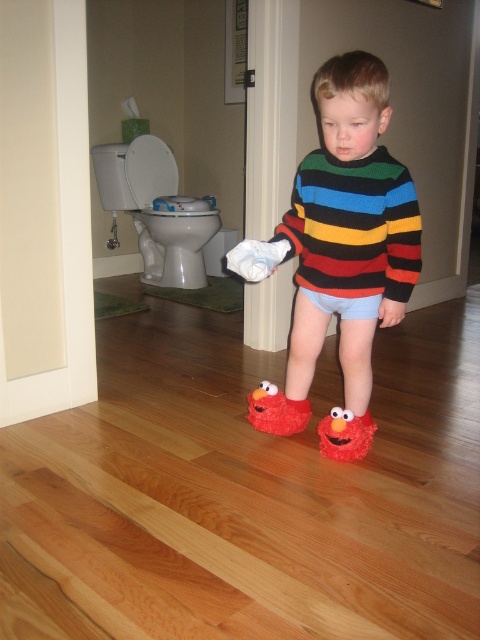
Can you confirm if fluffy red elmo slipper at lower center is positioned to the left of white soft socks at center?

Incorrect, fluffy red elmo slipper at lower center is not on the left side of white soft socks at center.

Between point (350, 419) and point (232, 257), which one is positioned behind?

Positioned behind is point (350, 419).

The width and height of the screenshot is (480, 640). In order to click on fluffy red elmo slipper at lower center in this screenshot , I will do `click(345, 435)`.

Identify the location of fluffy red elmo slipper at lower center. This screenshot has width=480, height=640. (345, 435).

Is point (328, 209) behind point (276, 394)?

No, (328, 209) is in front of (276, 394).

Locate an element on the screen. The height and width of the screenshot is (640, 480). multicolored knitted sweater at center is located at coordinates (348, 228).

Find the location of a particular element. This screenshot has width=480, height=640. multicolored knitted sweater at center is located at coordinates (348, 228).

Identify the location of multicolored knitted sweater at center. (348, 228).

Can you confirm if multicolored knitted sweater at center is positioned below white soft socks at center?

Incorrect, multicolored knitted sweater at center is not positioned below white soft socks at center.

Between point (330, 170) and point (240, 262), which one is positioned behind?

Positioned behind is point (330, 170).

This screenshot has height=640, width=480. I want to click on multicolored knitted sweater at center, so click(348, 228).